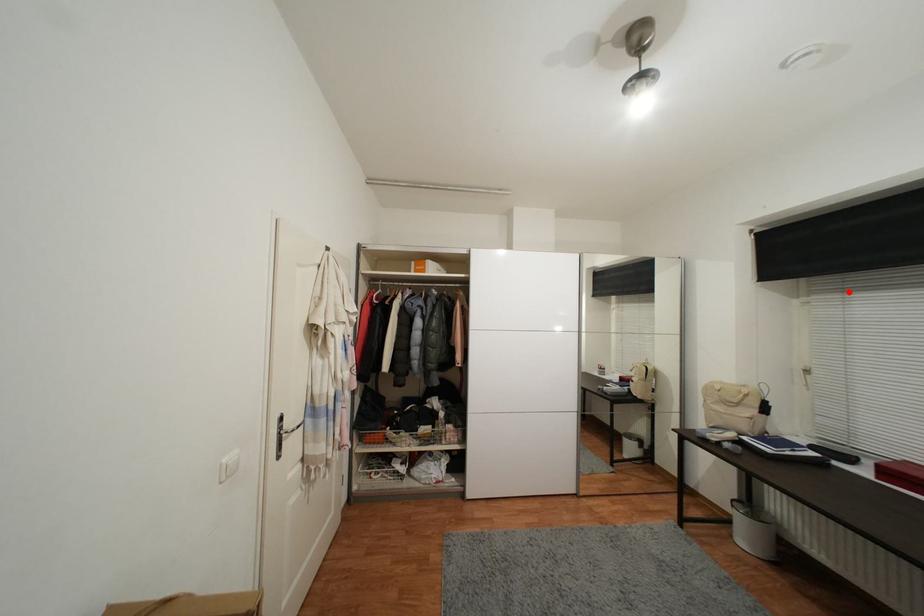
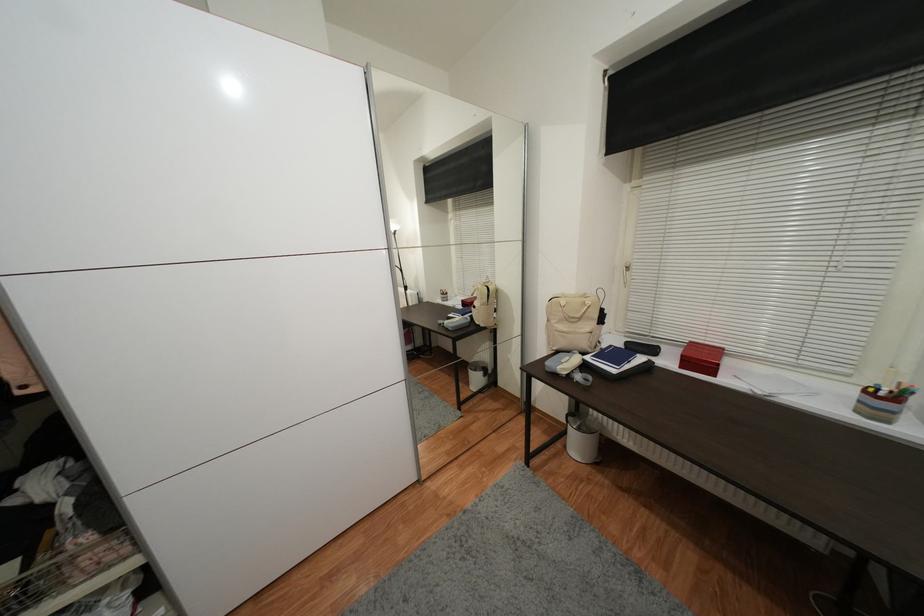
Where in the second image is the point corresponding to the highlighted location from the first image?

(678, 167)